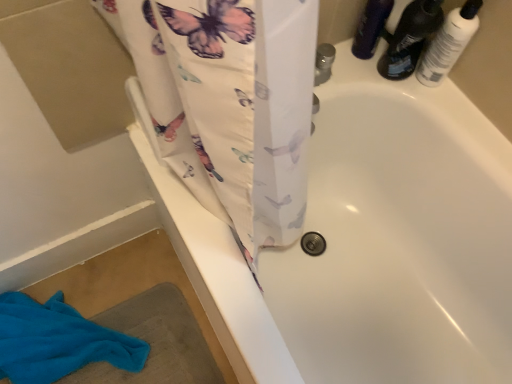
Question: Can you confirm if blue cotton towel at lower left is shorter than white glossy bottle at upper right, which is counted as the second toiletry, starting from the left?

Choices:
 (A) no
 (B) yes

Answer: (B)

Question: Considering the relative sizes of blue cotton towel at lower left and white glossy bottle at upper right, which is counted as the second toiletry, starting from the left, in the image provided, is blue cotton towel at lower left taller than white glossy bottle at upper right, which is counted as the second toiletry, starting from the left,?

Choices:
 (A) no
 (B) yes

Answer: (A)

Question: Can you confirm if blue cotton towel at lower left is smaller than white glossy bottle at upper right, positioned as the first toiletry in right-to-left order?

Choices:
 (A) no
 (B) yes

Answer: (A)

Question: Does blue cotton towel at lower left come in front of white glossy bottle at upper right, which is counted as the second toiletry, starting from the left?

Choices:
 (A) no
 (B) yes

Answer: (A)

Question: From the image's perspective, does blue cotton towel at lower left appear lower than white glossy bottle at upper right, which is counted as the second toiletry, starting from the left?

Choices:
 (A) no
 (B) yes

Answer: (B)

Question: Is blue cotton towel at lower left at the left side of white glossy bottle at upper right, positioned as the first toiletry in right-to-left order?

Choices:
 (A) no
 (B) yes

Answer: (B)

Question: From a real-world perspective, is blue cotton towel at lower left physically below matte black bottle at upper right, the first toiletry from the left?

Choices:
 (A) no
 (B) yes

Answer: (B)

Question: Is blue cotton towel at lower left positioned beyond the bounds of matte black bottle at upper right, marked as the second toiletry in a right-to-left arrangement?

Choices:
 (A) no
 (B) yes

Answer: (B)

Question: Is blue cotton towel at lower left oriented towards matte black bottle at upper right, the first toiletry from the left?

Choices:
 (A) yes
 (B) no

Answer: (B)

Question: Does blue cotton towel at lower left come in front of matte black bottle at upper right, the first toiletry from the left?

Choices:
 (A) yes
 (B) no

Answer: (B)

Question: Is blue cotton towel at lower left not close to matte black bottle at upper right, marked as the second toiletry in a right-to-left arrangement?

Choices:
 (A) no
 (B) yes

Answer: (B)

Question: From the image's perspective, does blue cotton towel at lower left appear lower than matte black bottle at upper right, the first toiletry from the left?

Choices:
 (A) no
 (B) yes

Answer: (B)

Question: Is the depth of blue cotton towel at lower left less than that of translucent plastic bottles at upper right?

Choices:
 (A) yes
 (B) no

Answer: (B)